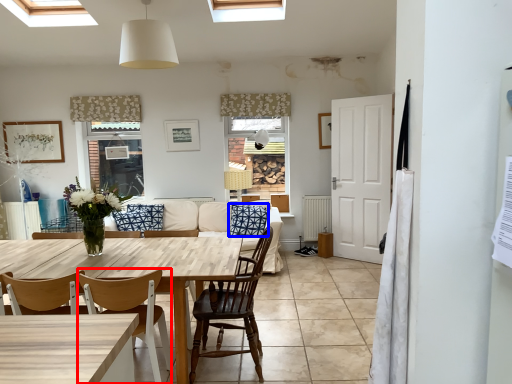
Question: Among these objects, which one is farthest to the camera, chair (highlighted by a red box) or pillow (highlighted by a blue box)?

Choices:
 (A) chair
 (B) pillow

Answer: (B)